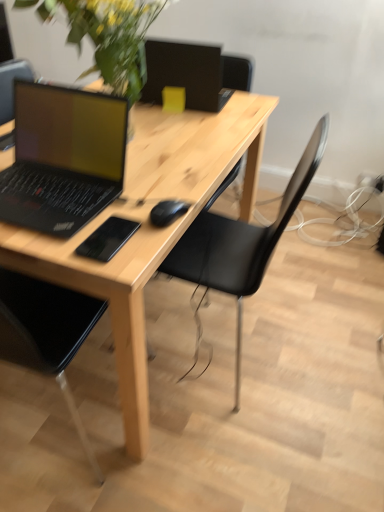
Locate an element on the screen. free space behind black matte mouse at center is located at coordinates (171, 180).